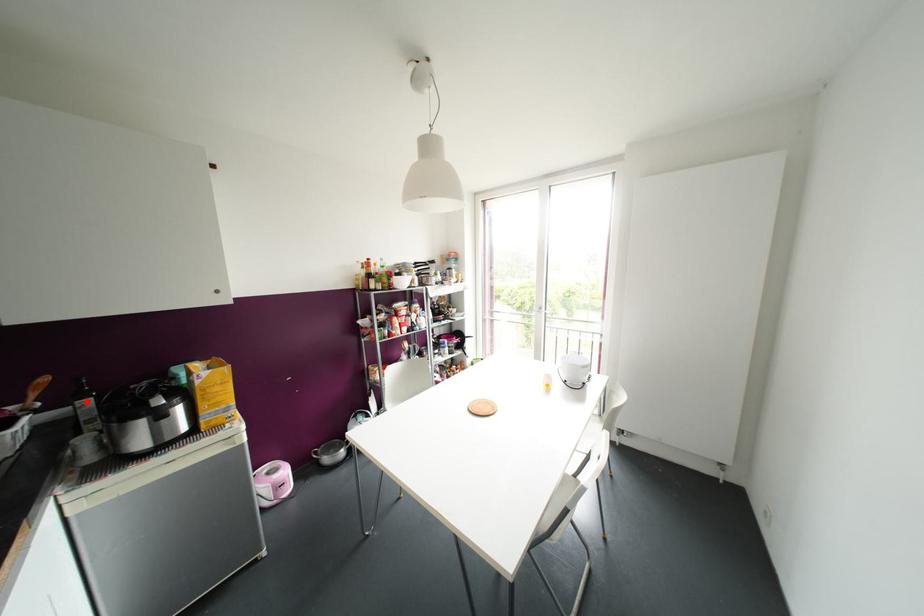
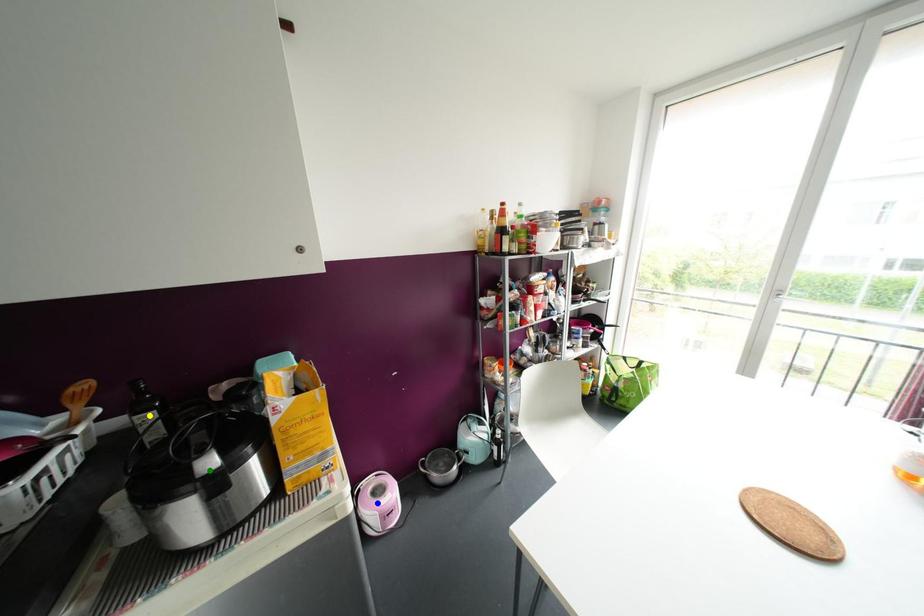
Question: I am providing you with two images of the same scene from different viewpoints. A red point is marked on the first image. You are given multiple points on the second image. Which mark in image 2 goes with the point in image 1?

Choices:
 (A) yellow point
 (B) green point
 (C) blue point

Answer: (A)